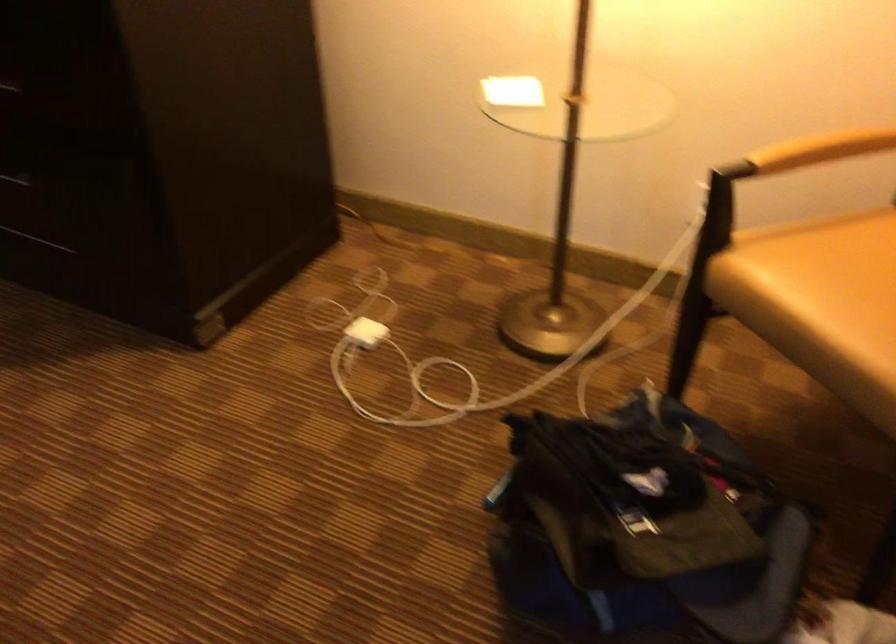
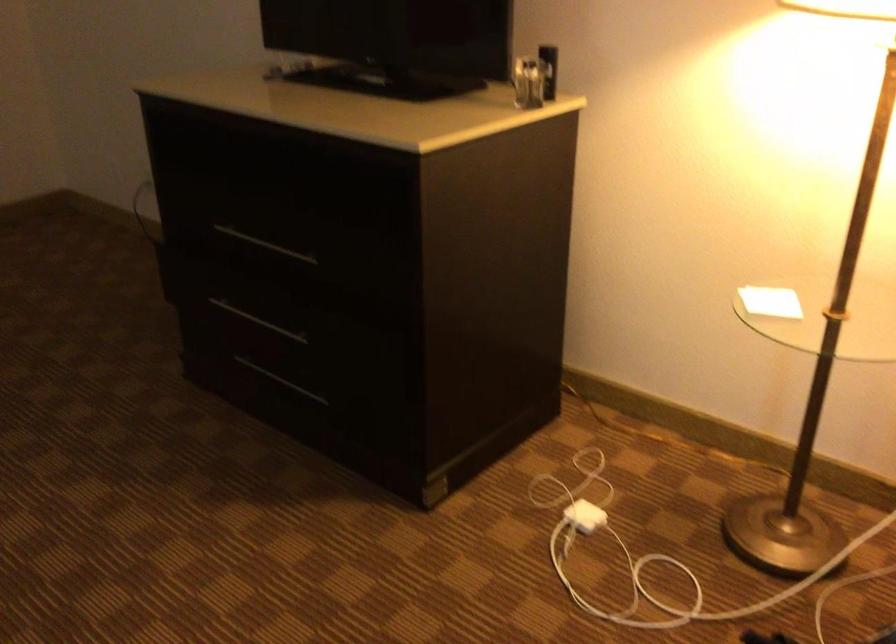
Question: The first image is from the beginning of the video and the second image is from the end. How did the camera likely rotate when shooting the video?

Choices:
 (A) Left
 (B) Right
 (C) Up
 (D) Down

Answer: (A)